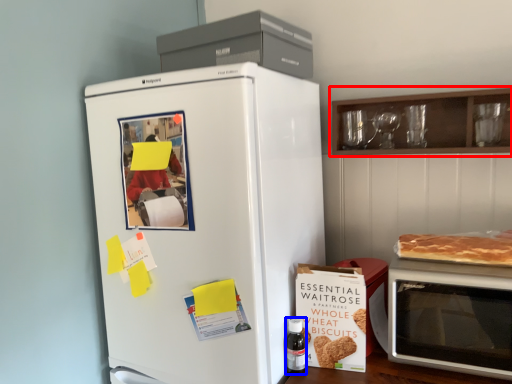
Question: Which object appears farthest to the camera in this image, cabinetry (highlighted by a red box) or bottle (highlighted by a blue box)?

Choices:
 (A) cabinetry
 (B) bottle

Answer: (B)